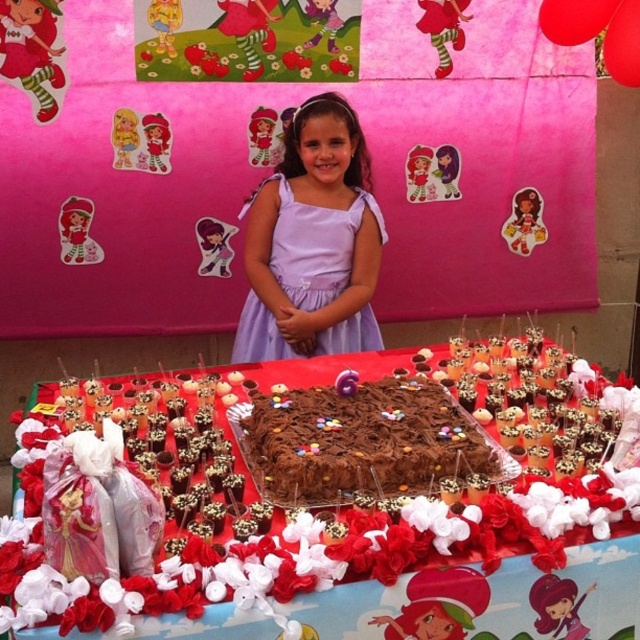
A photographer is setting up a camera on a tripod. The chocolate cake at center is the main subject. The photographer wants to ensure that the girl in the light purple dress is also in the shot. Given that the camera can capture a maximum distance of 4 feet between the subject and the farthest point in the frame, will the girl in the light purple dress be included in the photo?

The chocolate cake at center and the girl in the light purple dress are 3.85 feet apart. Since the camera can capture up to 4 feet, the girl in the light purple dress will be included in the photo.

You are a photographer setting up for a birthday photo shoot. The scene has a chocolatesmoothcake at center and a lavender satin dress at center. Which object should you focus on first if you want to capture the smaller item in the frame?

The chocolatesmoothcake at center is smaller than the lavender satin dress at center, so you should focus on the chocolatesmoothcake at center first to ensure it is properly captured in the frame.

You are a photographer at the birthday party. You need to capture a photo of the chocolate cake at center and the chocolatesmoothcake at center. Which one is positioned lower in the frame?

The chocolate cake at center is positioned lower in the frame than the chocolatesmoothcake at center.